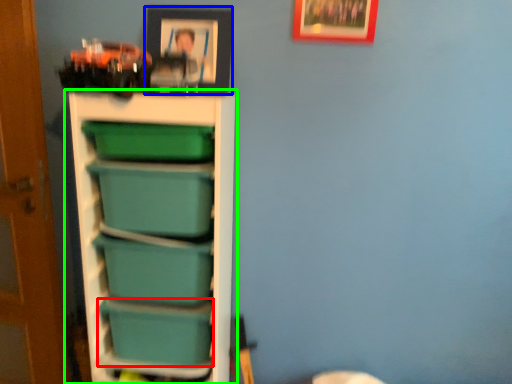
Question: Considering the real-world distances, which object is farthest from box (highlighted by a red box)? picture frame (highlighted by a blue box) or shelf (highlighted by a green box)?

Choices:
 (A) picture frame
 (B) shelf

Answer: (A)